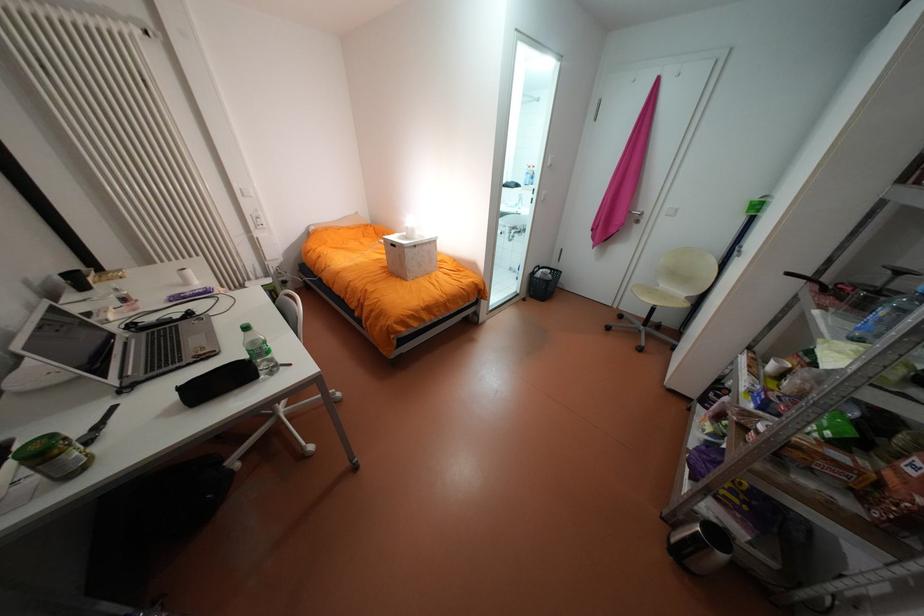
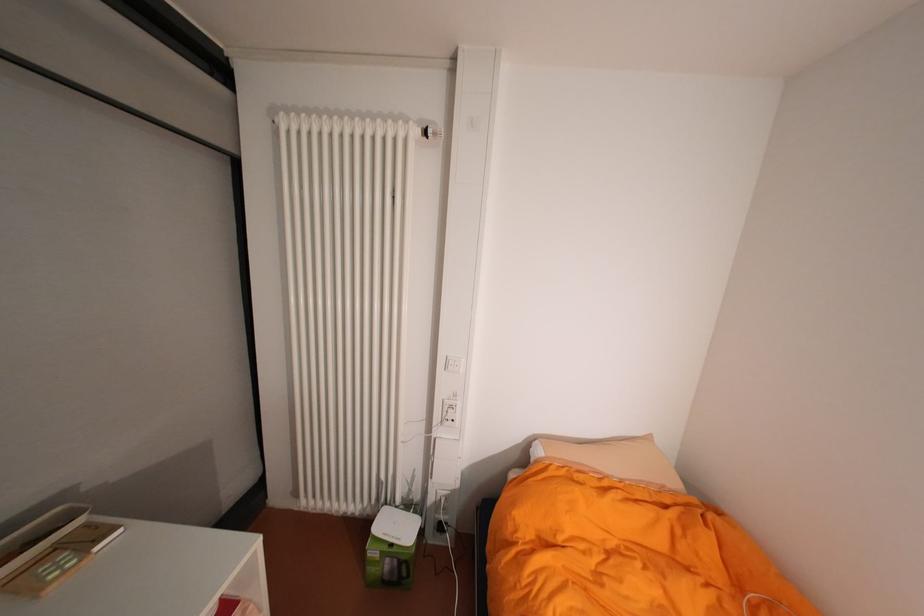
In the second image, find the point that corresponds to (x=156, y=33) in the first image.

(434, 132)